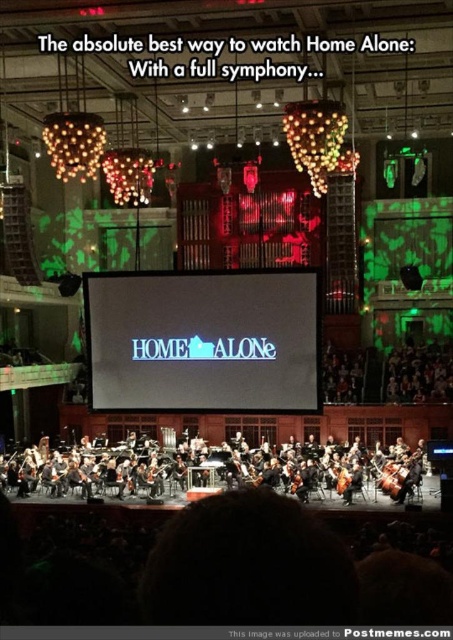
Which of these two, blue glossy screen at center or black glossy orchestra at center, stands taller?

blue glossy screen at center

Between point (160, 371) and point (51, 468), which one is positioned behind?

The point (51, 468) is behind.

Where is `blue glossy screen at center`? Image resolution: width=453 pixels, height=640 pixels. blue glossy screen at center is located at coordinates (202, 340).

Can you confirm if black glossy orchestra at center is thinner than matte black cello at center?

Incorrect, black glossy orchestra at center's width is not less than matte black cello at center's.

Is the position of black glossy orchestra at center less distant than that of matte black cello at center?

Yes, it is.

Is point (9, 467) positioned after point (149, 477)?

Yes, it is behind point (149, 477).

Where is `black glossy orchestra at center`? black glossy orchestra at center is located at coordinates (220, 472).

Which is below, blue glossy screen at center or matte black cello at center?

Positioned lower is matte black cello at center.

Does blue glossy screen at center have a greater width compared to matte black cello at center?

Correct, the width of blue glossy screen at center exceeds that of matte black cello at center.

Who is more forward, (304, 310) or (149, 477)?

Point (304, 310) is in front.

This screenshot has height=640, width=453. In order to click on blue glossy screen at center in this screenshot , I will do `click(202, 340)`.